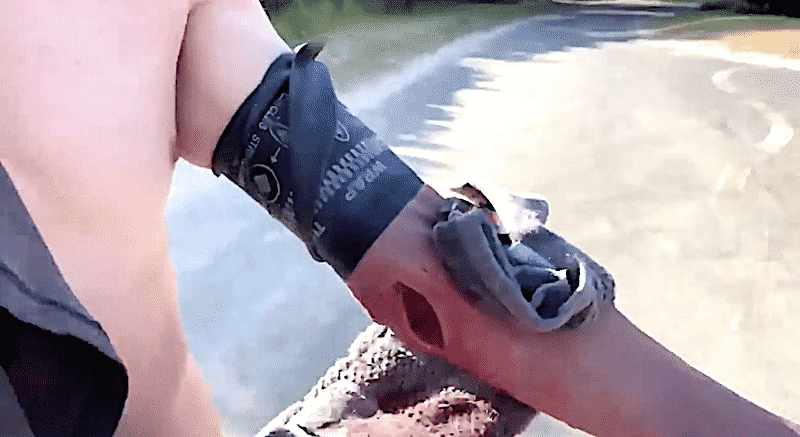
The image size is (800, 437). I want to click on towel, so click(562, 271).